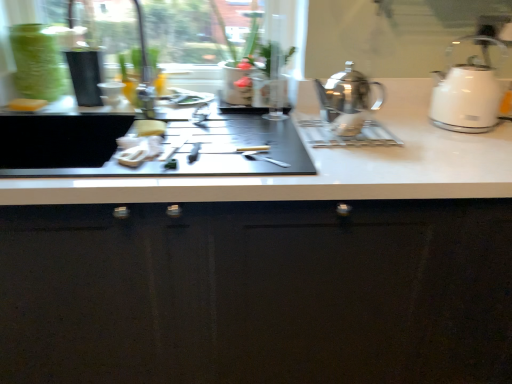
This screenshot has height=384, width=512. Find the location of `free location in front of white glossy kettle at right, acting as the 1th kettle starting from the right`. free location in front of white glossy kettle at right, acting as the 1th kettle starting from the right is located at coordinates (473, 145).